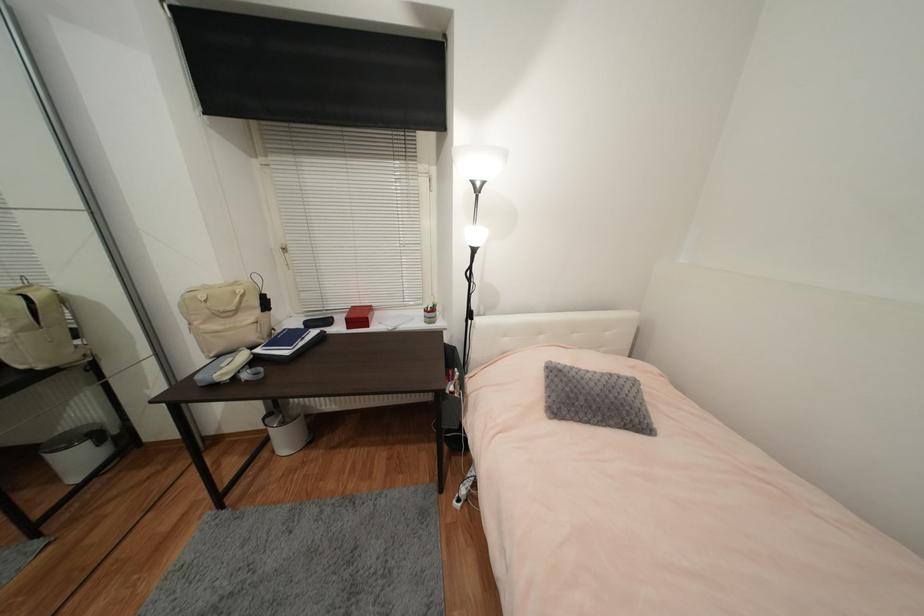
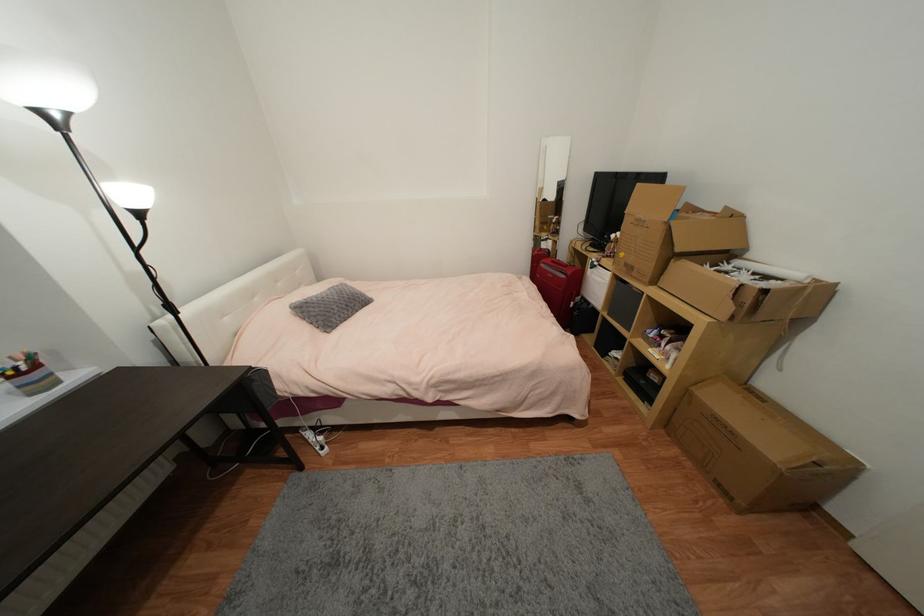
Based on the continuous images, in which direction is the camera rotating?

The camera's rotation is toward right-down.